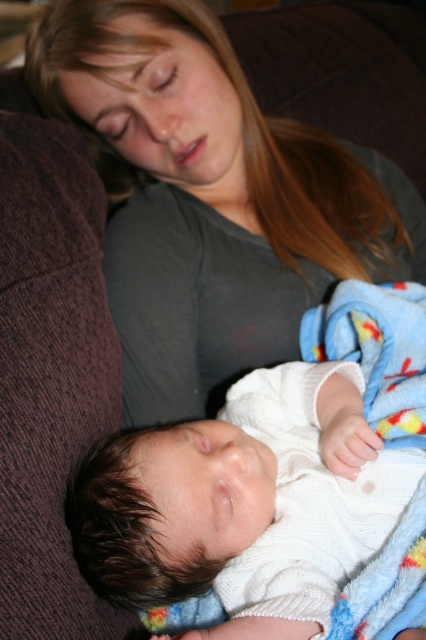
You are a clothing designer observing the scene. You need to determine which item of clothing has a bigger size between the matte gray shirt at upper center and the white knitted sweater at center. Which one is larger?

The matte gray shirt at upper center has a larger size compared to the white knitted sweater at center, so the matte gray shirt at upper center is larger.

From the picture: You are a photographer trying to capture a closeup of the white knitted sweater at center. You notice the matte gray shirt at upper center is blocking part of the sweater. Which object should you move to the right to get a better view of the sweater?

You should move the matte gray shirt at upper center to the right since it is currently to the left of the white knitted sweater at center, so moving it right would allow the sweater to be fully visible.